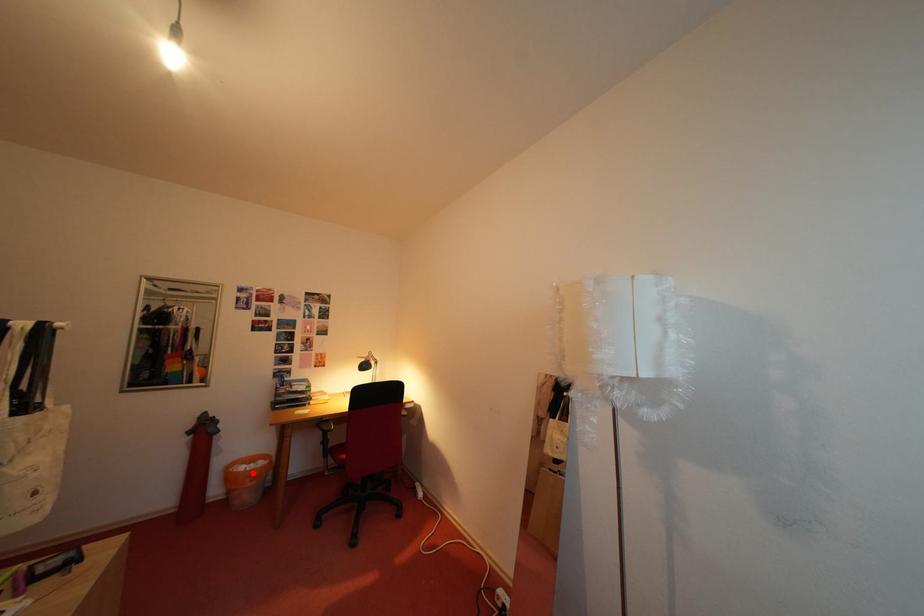
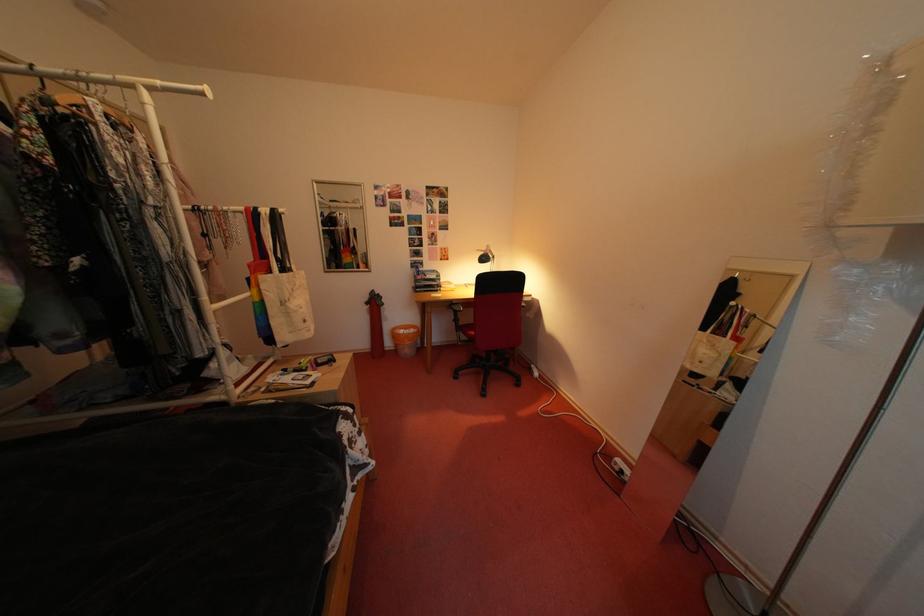
Locate, in the second image, the point that corresponds to the highlighted location in the first image.

(411, 336)